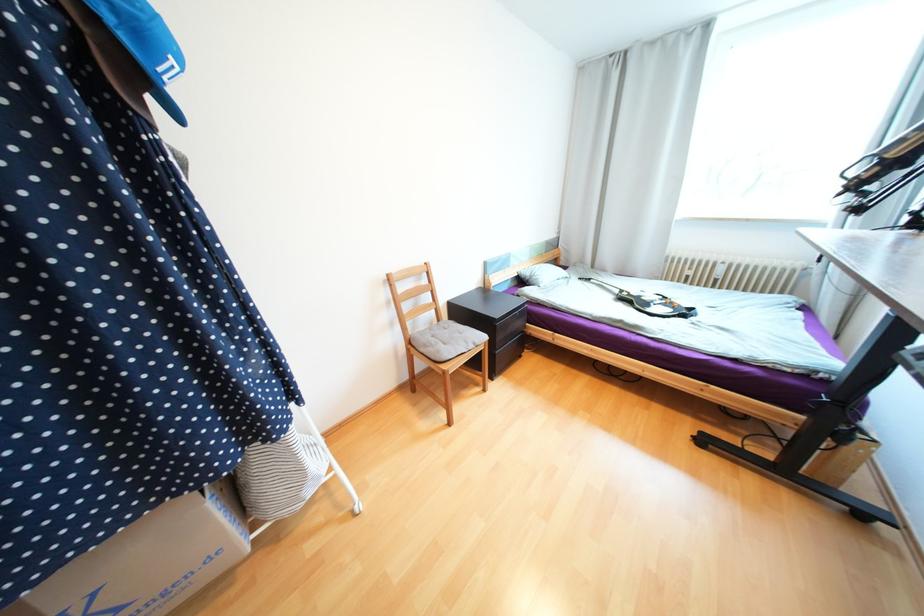
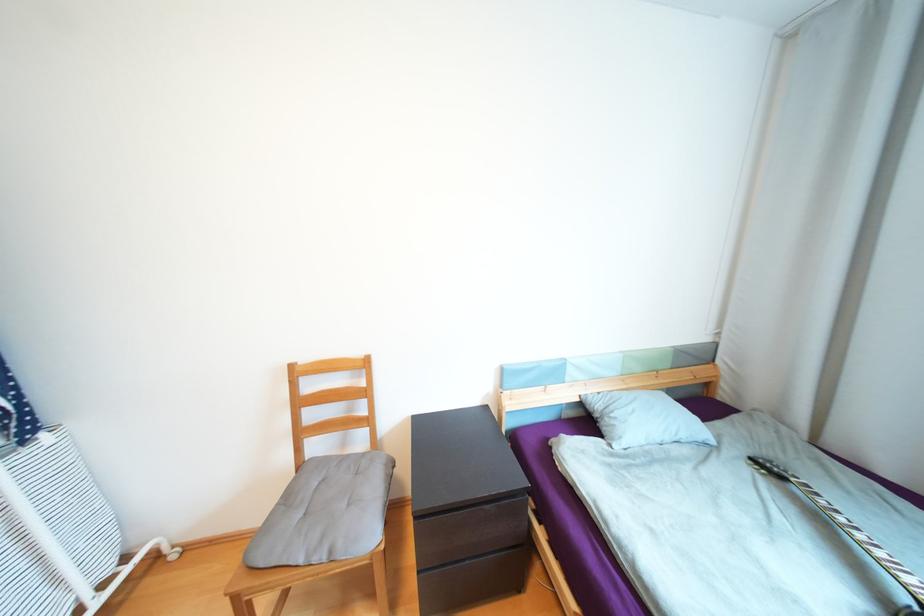
The point at [594,280] is marked in the first image. Where is the corresponding point in the second image?

(787, 477)